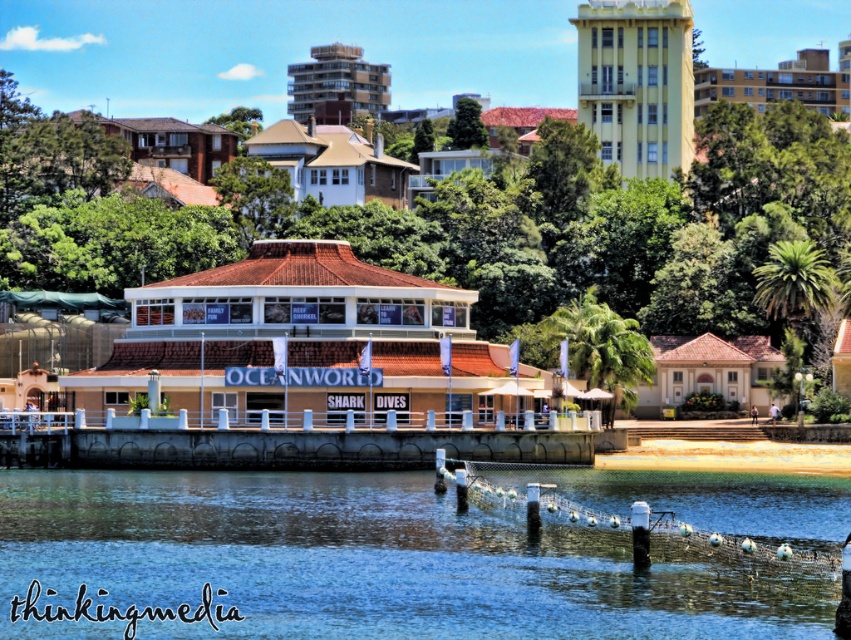
Question: Estimate the real-world distances between objects in this image. Which object is closer to the white matte house at upper center?

Choices:
 (A) beige textured building at center
 (B) beige concrete building at upper right
 (C) white concrete building at upper center

Answer: (C)

Question: Which of the following is the closest to the observer?

Choices:
 (A) (313, 499)
 (B) (176, 342)
 (C) (677, 17)

Answer: (A)

Question: Can you confirm if blue water at lower center is smaller than beige textured building at center?

Choices:
 (A) yes
 (B) no

Answer: (A)

Question: Does beige textured building at center appear under beige concrete building at upper right?

Choices:
 (A) no
 (B) yes

Answer: (B)

Question: Which point appears closest to the camera in this image?

Choices:
 (A) (574, 19)
 (B) (347, 90)
 (C) (317, 432)
 (D) (808, 545)

Answer: (D)

Question: Does blue water at lower center have a larger size compared to white concrete building at upper center?

Choices:
 (A) yes
 (B) no

Answer: (B)